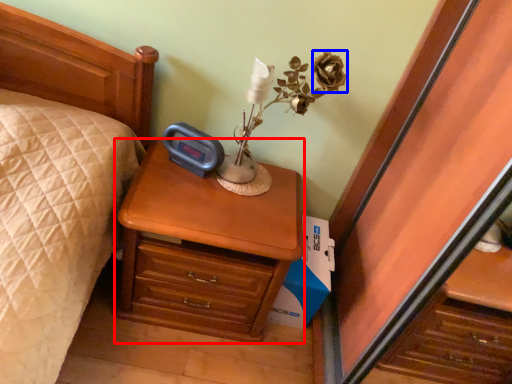
Question: Which point is further to the camera, nightstand (highlighted by a red box) or flower (highlighted by a blue box)?

Choices:
 (A) nightstand
 (B) flower

Answer: (B)